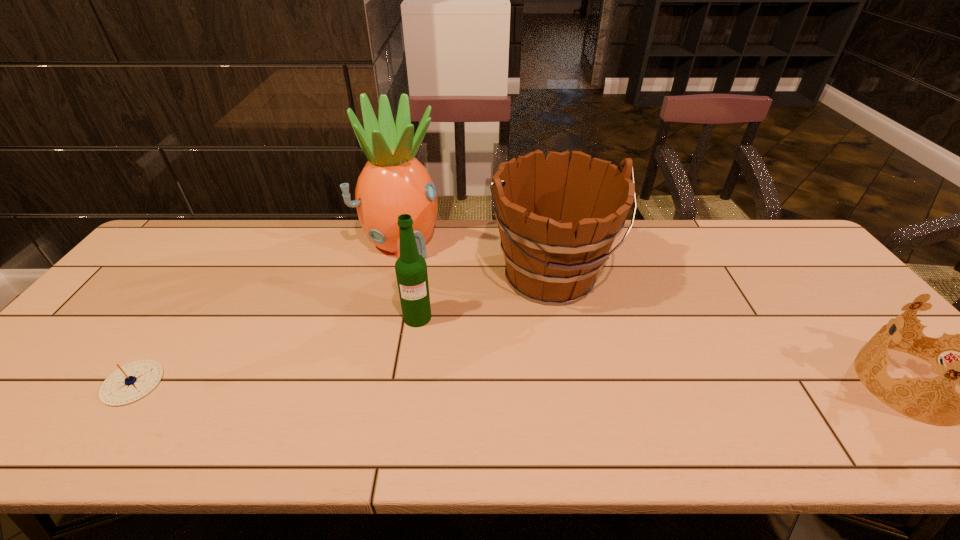
Find the location of a particular element. This screenshot has width=960, height=540. free space at the far left corner is located at coordinates (175, 240).

Identify the location of blank area at the near left corner. The height and width of the screenshot is (540, 960). (80, 404).

The width and height of the screenshot is (960, 540). I want to click on free spot between the compass and the beer bottle, so click(x=275, y=350).

Locate an element on the screen. The width and height of the screenshot is (960, 540). vacant space in between the pineapple and the shortest object is located at coordinates (267, 312).

The image size is (960, 540). What are the coordinates of `vacant space that is in between the leftmost object and the pineapple` in the screenshot? It's located at (267, 312).

Identify the location of free space between the shortest object and the beer bottle. The image size is (960, 540). click(x=275, y=350).

The image size is (960, 540). Identify the location of object that stands as the second closest to the wine bucket. (411, 269).

Find the location of `object that stands as the closest to the fourth object from left to right`. object that stands as the closest to the fourth object from left to right is located at coordinates (393, 182).

You are a GUI agent. You are given a task and a screenshot of the screen. Output one action in this format:
    pyautogui.click(x=<x>, y=<y>)
    Task: Click on the blank area in the image that satisfies the following two spatial constraints: 1. on the front side of the wine bucket; 2. on the right side of the pineapple
    The image size is (960, 540).
    Given the screenshot: What is the action you would take?
    pyautogui.click(x=394, y=276)